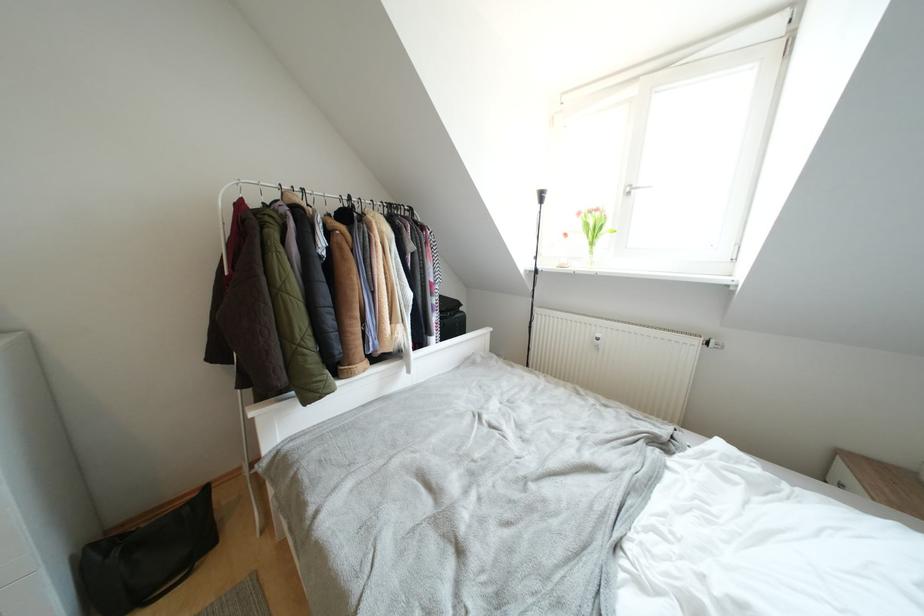
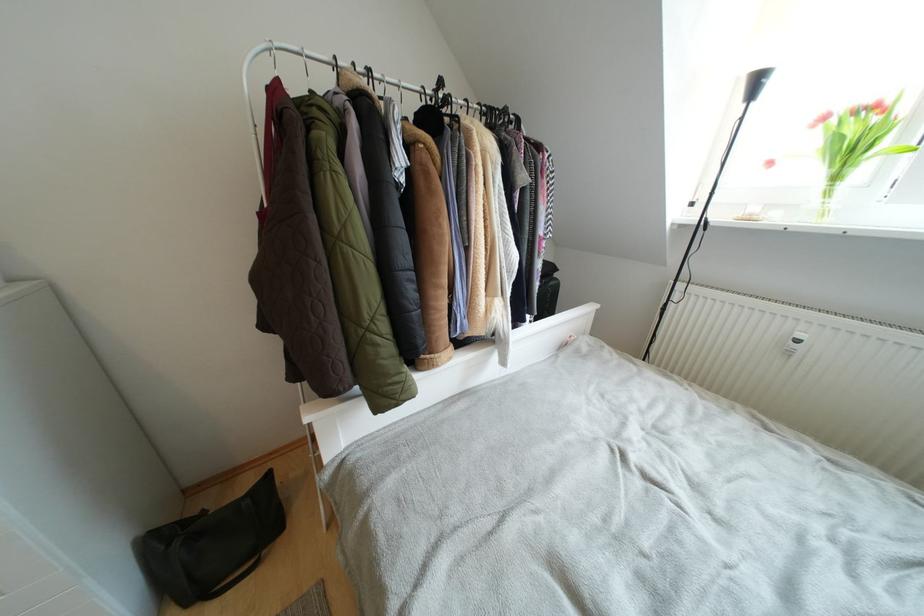
In the second image, find the point that corresponds to [597,248] in the first image.

(840, 182)